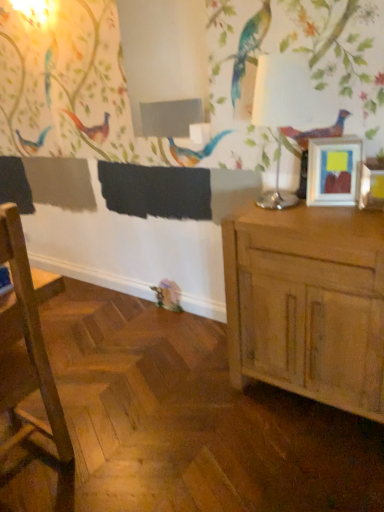
This screenshot has width=384, height=512. Describe the element at coordinates (26, 350) in the screenshot. I see `wooden chair at left` at that location.

Measure the distance between white glossy table lamp at upper right and camera.

They are 1.54 meters apart.

The width and height of the screenshot is (384, 512). I want to click on matte silver picture frame at upper right, so click(x=334, y=170).

Could you tell me if matte silver picture frame at upper right is turned towards white glossy table lamp at upper right?

No.

Can you confirm if matte silver picture frame at upper right is thinner than white glossy table lamp at upper right?

Correct, the width of matte silver picture frame at upper right is less than that of white glossy table lamp at upper right.

Which of these two, matte silver picture frame at upper right or white glossy table lamp at upper right, is bigger?

Bigger between the two is white glossy table lamp at upper right.

Considering the relative positions of matte silver picture frame at upper right and white glossy table lamp at upper right in the image provided, is matte silver picture frame at upper right behind white glossy table lamp at upper right?

Yes, it is.

Is matte silver picture frame at upper right to the right of light brown wood cabinet at right from the viewer's perspective?

Yes, matte silver picture frame at upper right is to the right of light brown wood cabinet at right.

What's the angular difference between matte silver picture frame at upper right and light brown wood cabinet at right's facing directions?

18.1 degrees.

Is matte silver picture frame at upper right in contact with light brown wood cabinet at right?

matte silver picture frame at upper right is not next to light brown wood cabinet at right, and they're not touching.

From a real-world perspective, does matte silver picture frame at upper right stand above light brown wood cabinet at right?

Yes, from a real-world perspective, matte silver picture frame at upper right is on top of light brown wood cabinet at right.

Considering the relative sizes of light brown wood cabinet at right and white glossy table lamp at upper right in the image provided, is light brown wood cabinet at right thinner than white glossy table lamp at upper right?

In fact, light brown wood cabinet at right might be wider than white glossy table lamp at upper right.

In terms of size, does light brown wood cabinet at right appear bigger or smaller than white glossy table lamp at upper right?

Considering their sizes, light brown wood cabinet at right takes up more space than white glossy table lamp at upper right.

Based on their positions, is light brown wood cabinet at right located to the left or right of white glossy table lamp at upper right?

light brown wood cabinet at right is to the right of white glossy table lamp at upper right.

Does light brown wood cabinet at right have a lesser height compared to white glossy table lamp at upper right?

No, light brown wood cabinet at right is not shorter than white glossy table lamp at upper right.

Considering the sizes of light brown wood cabinet at right and matte silver picture frame at upper right in the image, is light brown wood cabinet at right taller or shorter than matte silver picture frame at upper right?

In the image, light brown wood cabinet at right appears to be taller than matte silver picture frame at upper right.

How many degrees apart are the facing directions of light brown wood cabinet at right and matte silver picture frame at upper right?

light brown wood cabinet at right and matte silver picture frame at upper right are facing 18.1 degrees away from each other.

The height and width of the screenshot is (512, 384). Identify the location of picture frame above the light brown wood cabinet at right (from the image's perspective). (334, 170).

From the image's perspective, is light brown wood cabinet at right located above or below matte silver picture frame at upper right?

Based on their image positions, light brown wood cabinet at right is located beneath matte silver picture frame at upper right.

Where is `cabinetry below the wooden chair at left (from a real-world perspective)`? cabinetry below the wooden chair at left (from a real-world perspective) is located at coordinates (308, 303).

Is light brown wood cabinet at right thinner than wooden chair at left?

Yes.

Would you say wooden chair at left is part of light brown wood cabinet at right's contents?

No.

From a real-world perspective, which object rests below the other?

light brown wood cabinet at right is physically lower.

Does point (19, 314) lie behind point (380, 274)?

Yes, point (19, 314) is farther from viewer.

Between wooden chair at left and light brown wood cabinet at right, which one appears on the left side from the viewer's perspective?

wooden chair at left is more to the left.

How different are the orientations of wooden chair at left and light brown wood cabinet at right in degrees?

The angle between the facing direction of wooden chair at left and the facing direction of light brown wood cabinet at right is 89.2 degrees.

Measure the distance between wooden chair at left and light brown wood cabinet at right.

wooden chair at left is 37.81 inches from light brown wood cabinet at right.

Consider the image. Is white glossy table lamp at upper right inside the boundaries of light brown wood cabinet at right, or outside?

white glossy table lamp at upper right is not inside light brown wood cabinet at right, it's outside.

Considering the relative sizes of white glossy table lamp at upper right and light brown wood cabinet at right in the image provided, is white glossy table lamp at upper right shorter than light brown wood cabinet at right?

Indeed, white glossy table lamp at upper right has a lesser height compared to light brown wood cabinet at right.

Identify the location of table lamp above the light brown wood cabinet at right (from the image's perspective). click(x=280, y=109).

From a real-world perspective, is white glossy table lamp at upper right under light brown wood cabinet at right?

Incorrect, from a real-world perspective, white glossy table lamp at upper right is higher than light brown wood cabinet at right.

The height and width of the screenshot is (512, 384). In order to click on picture frame directly beneath the white glossy table lamp at upper right (from a real-world perspective) in this screenshot , I will do `click(334, 170)`.

Identify the location of cabinetry in front of the matte silver picture frame at upper right. This screenshot has width=384, height=512. (308, 303).

In the scene shown: Looking at the image, which one is located closer to light brown wood cabinet at right, white glossy table lamp at upper right or wooden chair at left?

white glossy table lamp at upper right lies closer to light brown wood cabinet at right than the other object.

Which object lies further to the anchor point white glossy table lamp at upper right, wooden chair at left or matte silver picture frame at upper right?

wooden chair at left is further to white glossy table lamp at upper right.

From the picture: When comparing their distances from wooden chair at left, does white glossy table lamp at upper right or light brown wood cabinet at right seem further?

Based on the image, white glossy table lamp at upper right appears to be further to wooden chair at left.

Considering their positions, is light brown wood cabinet at right positioned further to white glossy table lamp at upper right than matte silver picture frame at upper right?

→ light brown wood cabinet at right is positioned further to the anchor white glossy table lamp at upper right.

Based on the photo, when comparing their distances from white glossy table lamp at upper right, does light brown wood cabinet at right or wooden chair at left seem further?

wooden chair at left is positioned further to the anchor white glossy table lamp at upper right.

Looking at the image, which one is located closer to wooden chair at left, light brown wood cabinet at right or white glossy table lamp at upper right?

light brown wood cabinet at right is positioned closer to the anchor wooden chair at left.

Which object lies further to the anchor point matte silver picture frame at upper right, light brown wood cabinet at right or wooden chair at left?

wooden chair at left is further to matte silver picture frame at upper right.

Considering their positions, is wooden chair at left positioned closer to matte silver picture frame at upper right than white glossy table lamp at upper right?

white glossy table lamp at upper right.

This screenshot has height=512, width=384. In order to click on table lamp situated between wooden chair at left and light brown wood cabinet at right from left to right in this screenshot , I will do `click(280, 109)`.

At what (x,y) coordinates should I click in order to perform the action: click on picture frame between white glossy table lamp at upper right and light brown wood cabinet at right vertically. Please return your answer as a coordinate pair (x, y). This screenshot has height=512, width=384. Looking at the image, I should click on (334, 170).

Identify the location of table lamp located between wooden chair at left and matte silver picture frame at upper right in the left-right direction. Image resolution: width=384 pixels, height=512 pixels. (280, 109).

This screenshot has height=512, width=384. In order to click on cabinetry situated between wooden chair at left and matte silver picture frame at upper right from left to right in this screenshot , I will do `click(308, 303)`.